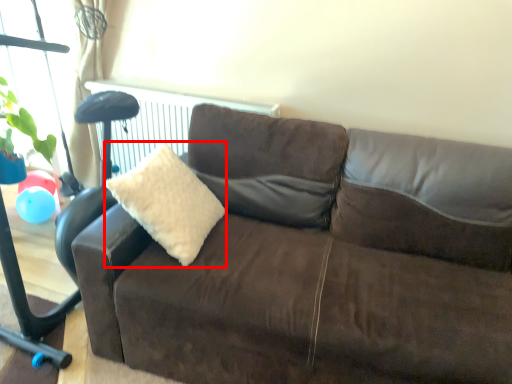
Question: From the image, what is the correct spatial relationship of throw pillow (annotated by the red box) in relation to studio couch?

Choices:
 (A) right
 (B) left

Answer: (B)